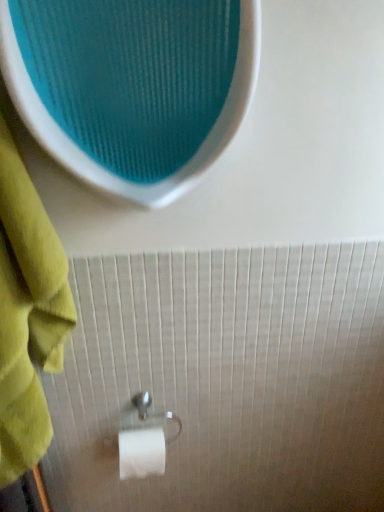
Question: In terms of height, does satin silver toilet paper holder at lower center look taller or shorter compared to green cotton towel at left?

Choices:
 (A) short
 (B) tall

Answer: (A)

Question: In terms of width, does satin silver toilet paper holder at lower center look wider or thinner when compared to green cotton towel at left?

Choices:
 (A) thin
 (B) wide

Answer: (A)

Question: In the image, is satin silver toilet paper holder at lower center on the left side or the right side of green cotton towel at left?

Choices:
 (A) left
 (B) right

Answer: (B)

Question: From a real-world perspective, relative to satin silver toilet paper holder at lower center, is green cotton towel at left vertically above or below?

Choices:
 (A) below
 (B) above

Answer: (B)

Question: Would you say green cotton towel at left is to the left or to the right of satin silver toilet paper holder at lower center in the picture?

Choices:
 (A) left
 (B) right

Answer: (A)

Question: Is green cotton towel at left taller or shorter than satin silver toilet paper holder at lower center?

Choices:
 (A) tall
 (B) short

Answer: (A)

Question: Is point (29, 270) closer or farther from the camera than point (135, 440)?

Choices:
 (A) closer
 (B) farther

Answer: (A)